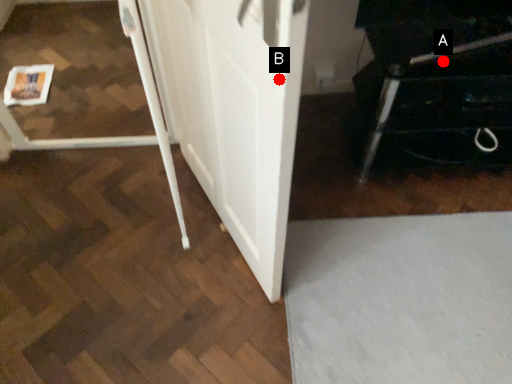
Question: Two points are circled on the image, labeled by A and B beside each circle. Among these points, which one is farthest from the camera?

Choices:
 (A) A is further
 (B) B is further

Answer: (A)